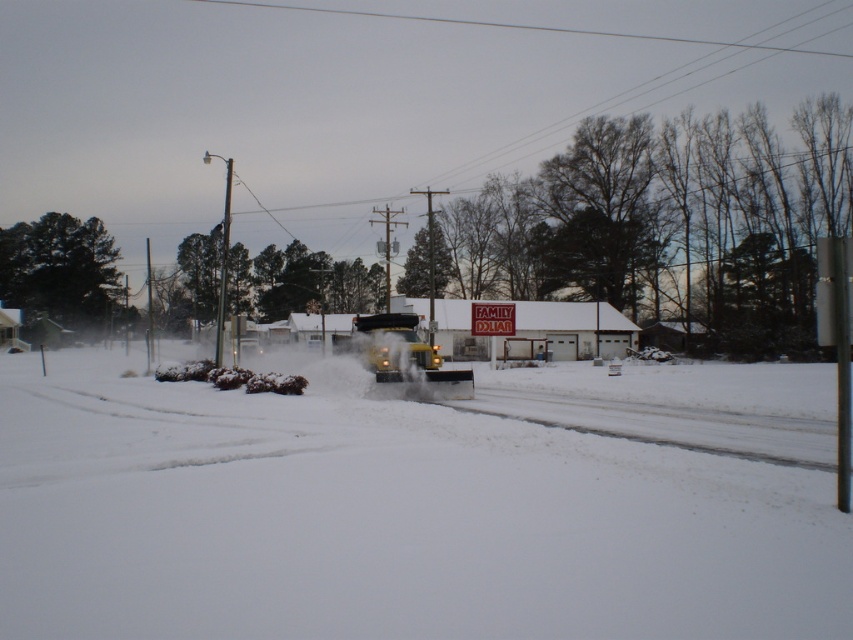
Question: Which point appears farthest from the camera in this image?

Choices:
 (A) (289, 593)
 (B) (410, 324)

Answer: (B)

Question: Where is white powdery snow at center located in relation to yellow matte truck at center in the image?

Choices:
 (A) above
 (B) below

Answer: (B)

Question: Which point is closer to the camera?

Choices:
 (A) yellow matte truck at center
 (B) white powdery snow at center

Answer: (B)

Question: Is white powdery snow at center bigger than yellow matte truck at center?

Choices:
 (A) yes
 (B) no

Answer: (A)

Question: Can you confirm if white powdery snow at center is positioned to the right of yellow matte truck at center?

Choices:
 (A) no
 (B) yes

Answer: (A)